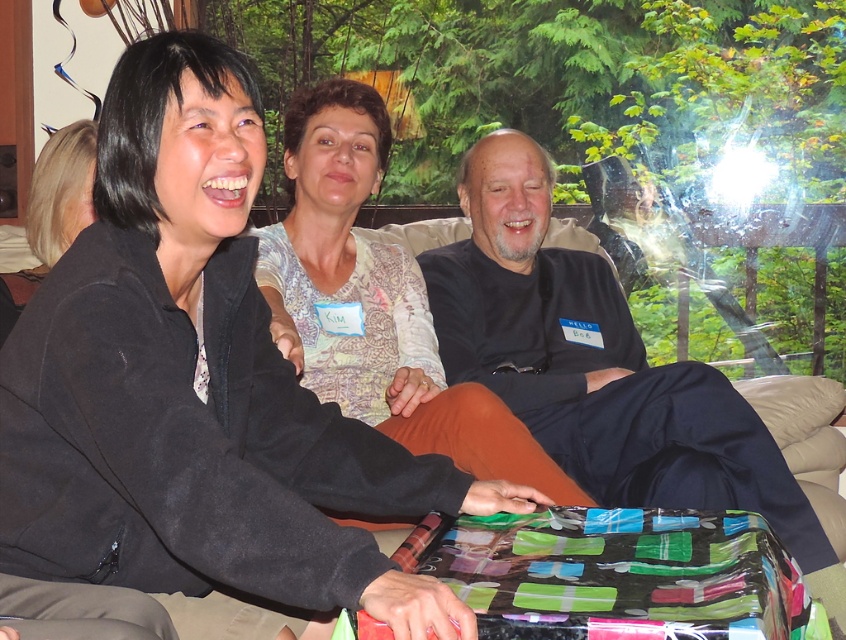
Which is behind, point (547, 284) or point (378, 259)?

Positioned behind is point (547, 284).

Does black matte shirt at center have a greater width compared to patterned fabric shirt at center?

Correct, the width of black matte shirt at center exceeds that of patterned fabric shirt at center.

Does point (834, 584) come in front of point (364, 180)?

That is True.

At what (x,y) coordinates should I click in order to perform the action: click on black matte shirt at center. Please return your answer as a coordinate pair (x, y). This screenshot has width=846, height=640. Looking at the image, I should click on (600, 369).